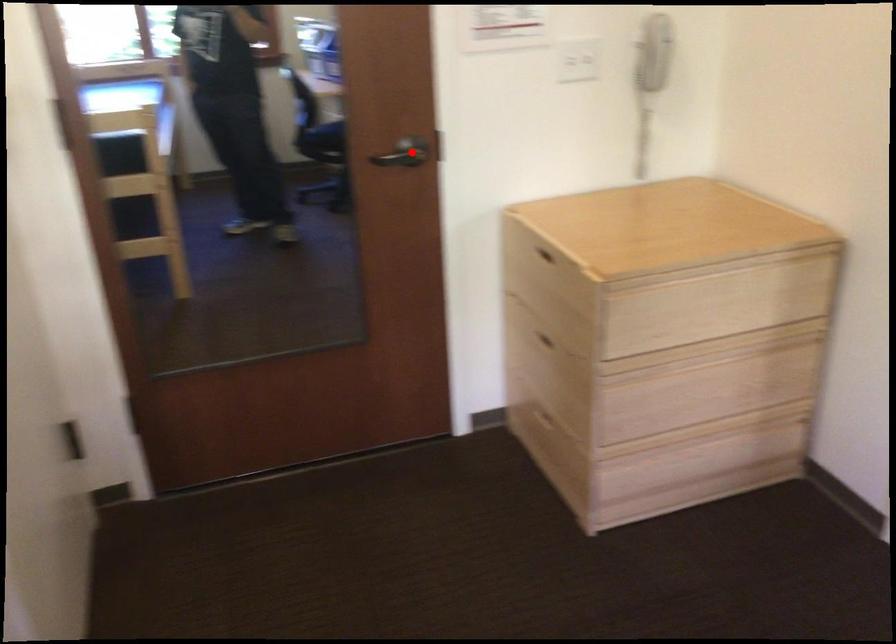
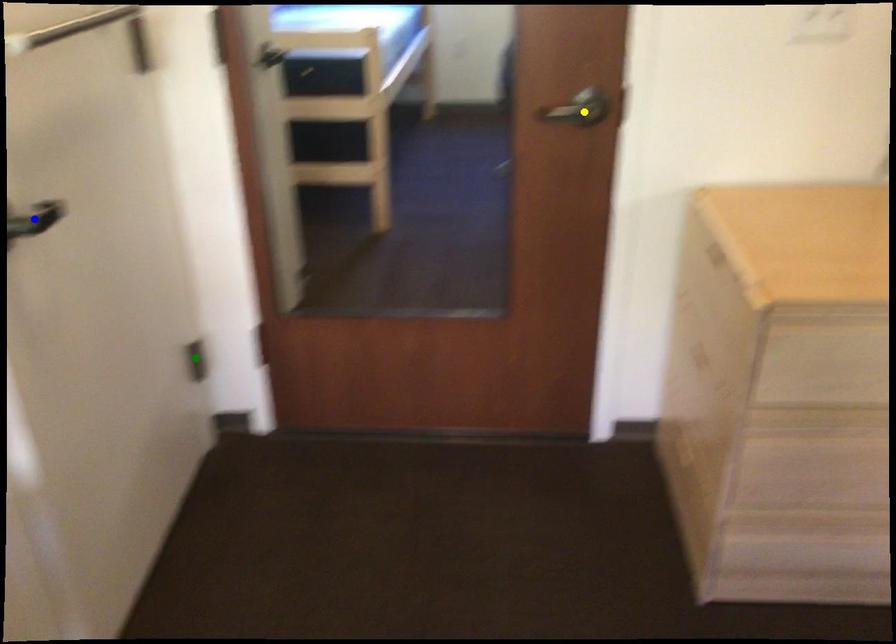
Question: I am providing you with two images of the same scene from different viewpoints. A red point is marked on the first image. You are given multiple points on the second image. In image 2, which mark is for the same physical point as the one in image 1?

Choices:
 (A) green point
 (B) yellow point
 (C) blue point

Answer: (B)